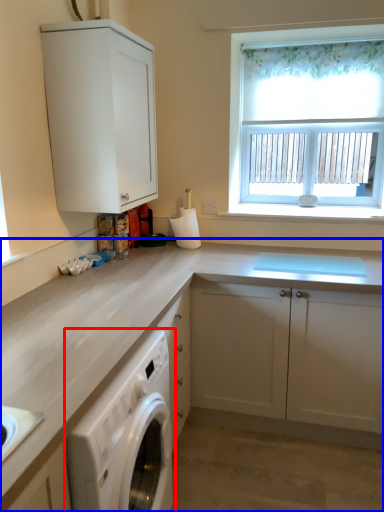
Question: Which point is closer to the camera, home appliance (highlighted by a red box) or cabinetry (highlighted by a blue box)?

Choices:
 (A) home appliance
 (B) cabinetry

Answer: (A)